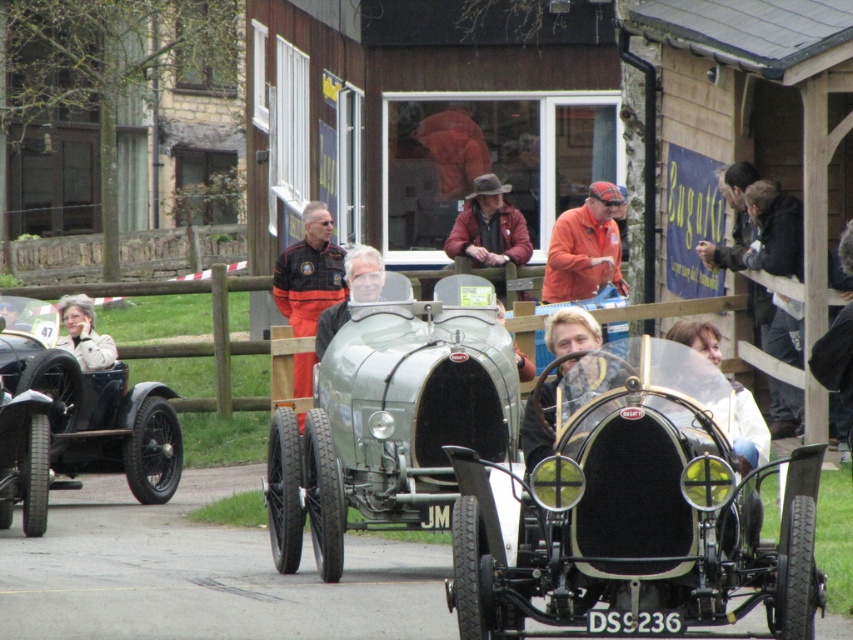
In the scene shown: Between silver metallic race car at center and silver metallic car at center, which one has more height?

With more height is silver metallic race car at center.

Can you confirm if silver metallic race car at center is positioned below silver metallic car at center?

Indeed, silver metallic race car at center is positioned under silver metallic car at center.

At what (x,y) coordinates should I click in order to perform the action: click on silver metallic race car at center. Please return your answer as a coordinate pair (x, y). The width and height of the screenshot is (853, 640). Looking at the image, I should click on (392, 417).

This screenshot has height=640, width=853. Find the location of `silver metallic race car at center`. silver metallic race car at center is located at coordinates (392, 417).

In the scene shown: Does orange fabric jacket at center have a greater width compared to silver metallic car at center?

Yes, orange fabric jacket at center is wider than silver metallic car at center.

Can you confirm if orange fabric jacket at center is taller than silver metallic car at center?

Yes, orange fabric jacket at center is taller than silver metallic car at center.

Image resolution: width=853 pixels, height=640 pixels. Describe the element at coordinates (309, 273) in the screenshot. I see `orange fabric jacket at center` at that location.

The width and height of the screenshot is (853, 640). I want to click on orange fabric jacket at center, so click(x=309, y=273).

Describe the element at coordinates (309, 273) in the screenshot. I see `orange fabric jacket at center` at that location.

Is orange fabric jacket at center to the right of leather jacket at center from the viewer's perspective?

In fact, orange fabric jacket at center is to the left of leather jacket at center.

Does point (300, 372) come in front of point (488, 204)?

Yes.

Identify the location of orange fabric jacket at center. This screenshot has width=853, height=640. (309, 273).